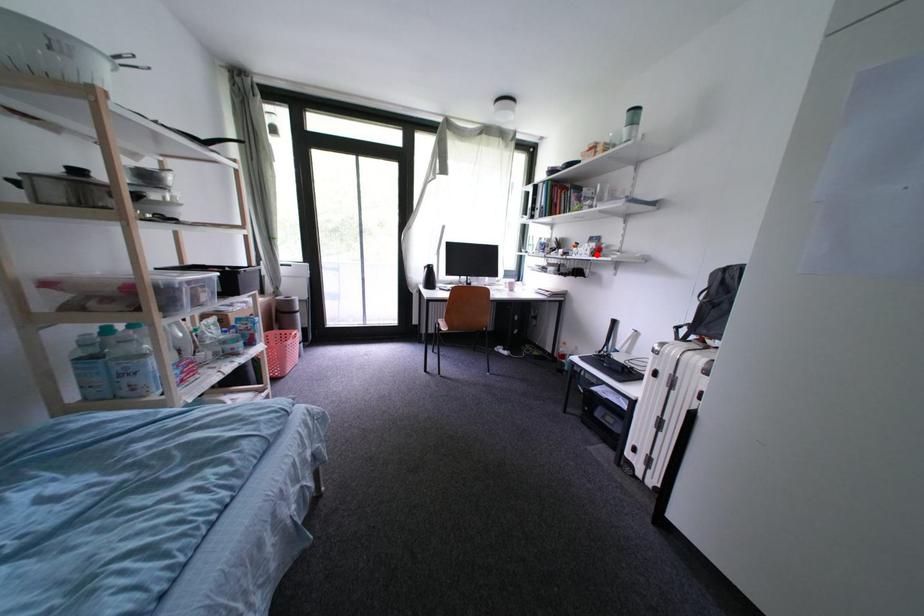
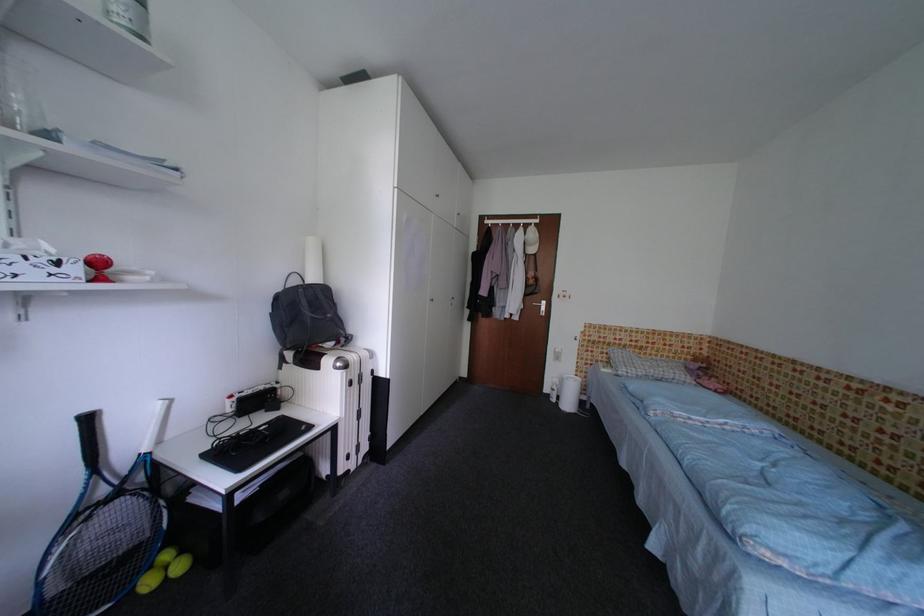
Find the pixel in the second image that matches the highlighted location in the first image.

(83, 272)